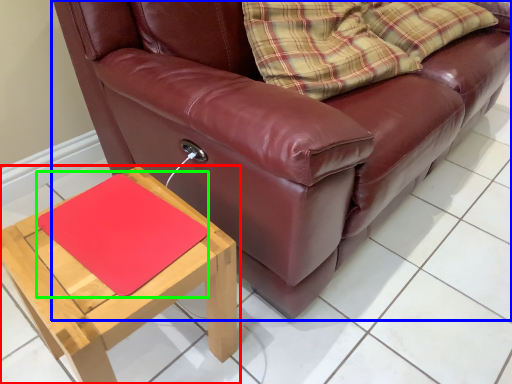
Question: Based on their relative distances, which object is nearer to table (highlighted by a red box)? Choose from studio couch (highlighted by a blue box) and mat (highlighted by a green box).

Choices:
 (A) studio couch
 (B) mat

Answer: (B)